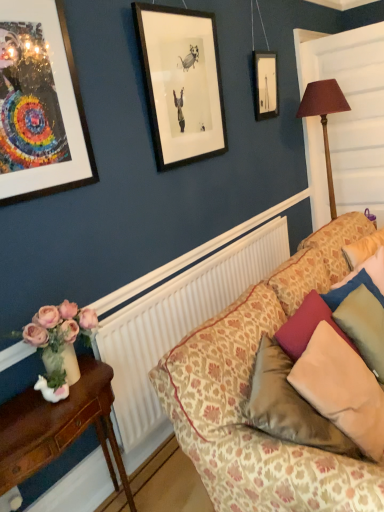
Question: Does patterned fabric couch at lower right have a greater height compared to velvet beige pillow at lower right, the second pillow viewed from the right?

Choices:
 (A) no
 (B) yes

Answer: (B)

Question: Considering the relative positions of patterned fabric couch at lower right and velvet beige pillow at lower right, the second pillow viewed from the right, in the image provided, is patterned fabric couch at lower right to the right of velvet beige pillow at lower right, the second pillow viewed from the right, from the viewer's perspective?

Choices:
 (A) no
 (B) yes

Answer: (B)

Question: From the image's perspective, is patterned fabric couch at lower right located beneath velvet beige pillow at lower right, the second pillow viewed from the right?

Choices:
 (A) yes
 (B) no

Answer: (B)

Question: From a real-world perspective, does patterned fabric couch at lower right sit lower than velvet beige pillow at lower right, arranged as the first pillow when viewed from the left?

Choices:
 (A) yes
 (B) no

Answer: (A)

Question: Considering the relative sizes of patterned fabric couch at lower right and velvet beige pillow at lower right, arranged as the first pillow when viewed from the left, in the image provided, is patterned fabric couch at lower right thinner than velvet beige pillow at lower right, arranged as the first pillow when viewed from the left,?

Choices:
 (A) no
 (B) yes

Answer: (A)

Question: Is brown fabric lampshade at right taller or shorter than patterned fabric couch at lower right?

Choices:
 (A) tall
 (B) short

Answer: (A)

Question: Is point (329, 153) positioned closer to the camera than point (273, 325)?

Choices:
 (A) closer
 (B) farther

Answer: (B)

Question: Based on their positions, is brown fabric lampshade at right located to the left or right of patterned fabric couch at lower right?

Choices:
 (A) left
 (B) right

Answer: (B)

Question: In the image, is brown fabric lampshade at right positioned in front of or behind patterned fabric couch at lower right?

Choices:
 (A) behind
 (B) front

Answer: (A)

Question: From a real-world perspective, is metallic gold picture frame at upper left physically located above or below velvet beige pillow at lower right, the second pillow viewed from the right?

Choices:
 (A) below
 (B) above

Answer: (B)

Question: Is metallic gold picture frame at upper left bigger or smaller than velvet beige pillow at lower right, arranged as the first pillow when viewed from the left?

Choices:
 (A) big
 (B) small

Answer: (B)

Question: Choose the correct answer: Is metallic gold picture frame at upper left inside velvet beige pillow at lower right, the second pillow viewed from the right, or outside it?

Choices:
 (A) inside
 (B) outside

Answer: (B)

Question: Considering the relative positions of metallic gold picture frame at upper left and velvet beige pillow at lower right, arranged as the first pillow when viewed from the left, in the image provided, is metallic gold picture frame at upper left to the left or to the right of velvet beige pillow at lower right, arranged as the first pillow when viewed from the left,?

Choices:
 (A) right
 (B) left

Answer: (B)

Question: Does point (352, 330) appear closer or farther from the camera than point (314, 93)?

Choices:
 (A) farther
 (B) closer

Answer: (B)

Question: From the image's perspective, relative to brown fabric lampshade at right, is velvet green pillow at right, which appears as the first pillow when viewed from the right, above or below?

Choices:
 (A) above
 (B) below

Answer: (B)